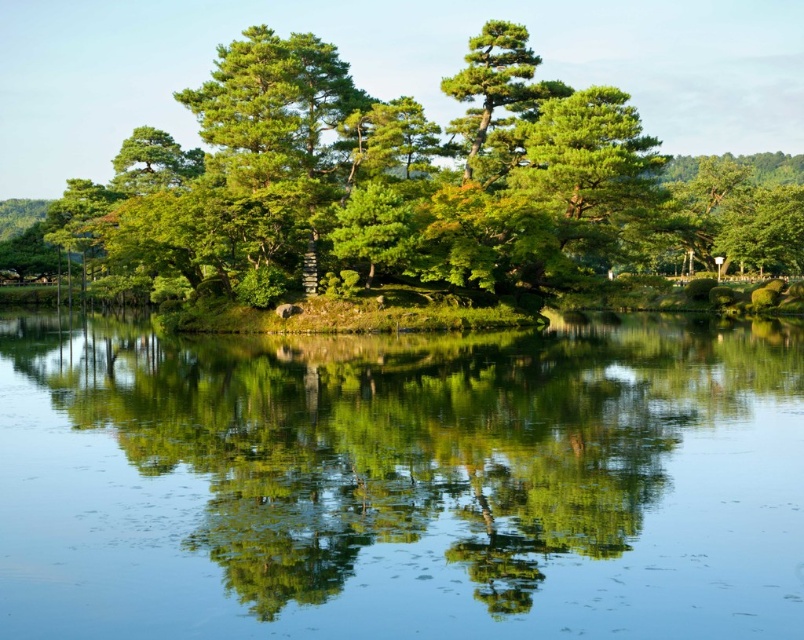
Question: Is the position of clear water at center more distant than that of green leafy tree at center?

Choices:
 (A) no
 (B) yes

Answer: (A)

Question: Can you confirm if clear water at center is positioned below green leafy tree at center?

Choices:
 (A) no
 (B) yes

Answer: (B)

Question: Does clear water at center appear under green leafy tree at center?

Choices:
 (A) yes
 (B) no

Answer: (A)

Question: Which of the following is the closest to the observer?

Choices:
 (A) (417, 589)
 (B) (725, 205)

Answer: (A)